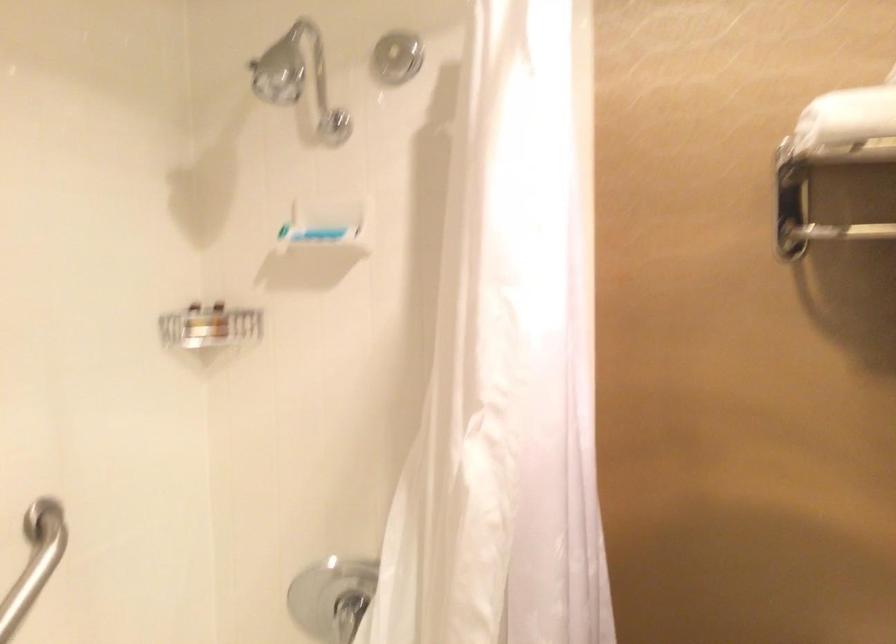
Where would you adjust the chrome shower head? Please return your answer as a coordinate pair (x, y).

(279, 73)